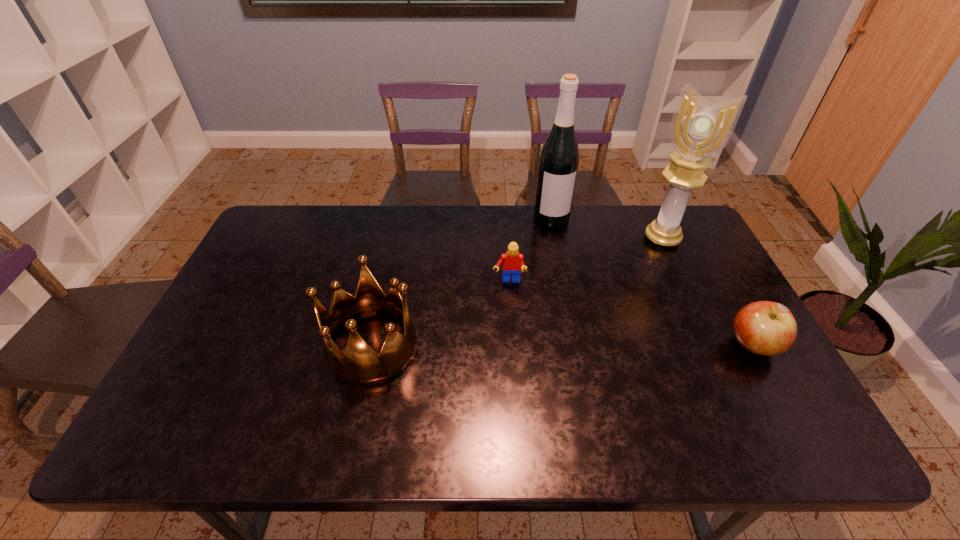
Find the location of a particular element. crown is located at coordinates click(361, 366).

At what (x,y) coordinates should I click in order to perform the action: click on the leftmost object. Please return your answer as a coordinate pair (x, y). This screenshot has height=540, width=960. Looking at the image, I should click on (361, 366).

The height and width of the screenshot is (540, 960). I want to click on apple, so click(766, 328).

You are a GUI agent. You are given a task and a screenshot of the screen. Output one action in this format:
    pyautogui.click(x=<x>, y=<y>)
    Task: Click on the wine bottle
    The height and width of the screenshot is (540, 960).
    Given the screenshot: What is the action you would take?
    pyautogui.click(x=559, y=158)

The height and width of the screenshot is (540, 960). I want to click on Lego, so click(513, 263).

Find the location of a particular element. The image size is (960, 540). the third farthest object is located at coordinates (513, 263).

I want to click on award, so click(698, 130).

Locate an element on the screen. free point located 0.130m on the left of the crown is located at coordinates (276, 347).

I want to click on free space located on the back of the apple, so click(717, 282).

Identify the location of free location located on the label of the third object from right to left. This screenshot has width=960, height=540. (573, 303).